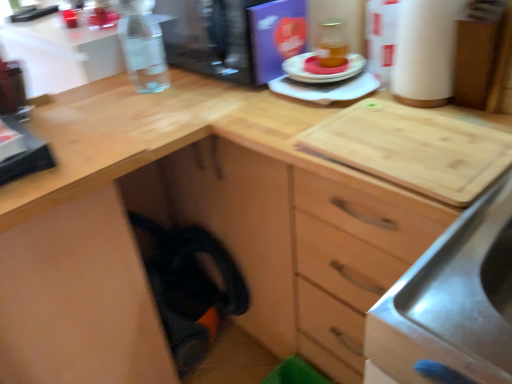
Find the location of a particular element. The width and height of the screenshot is (512, 384). empty space that is to the right of clear glass bottle at upper left is located at coordinates (202, 82).